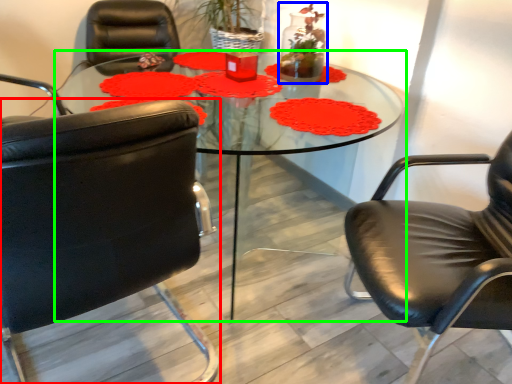
Question: Considering the real-world distances, which object is closest to chair (highlighted by a red box)? floral arrangement (highlighted by a blue box) or coffee table (highlighted by a green box).

Choices:
 (A) floral arrangement
 (B) coffee table

Answer: (A)